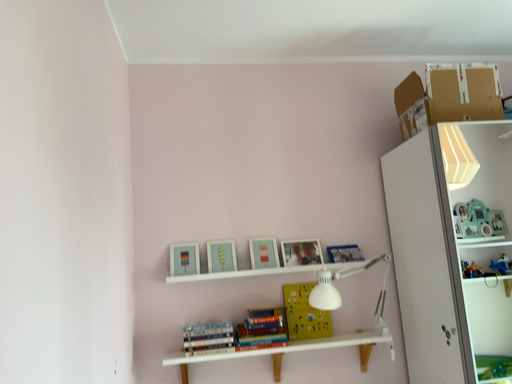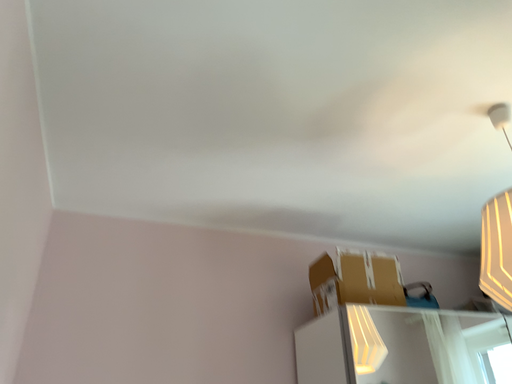
Question: How did the camera likely rotate when shooting the video?

Choices:
 (A) rotated left
 (B) rotated right

Answer: (B)